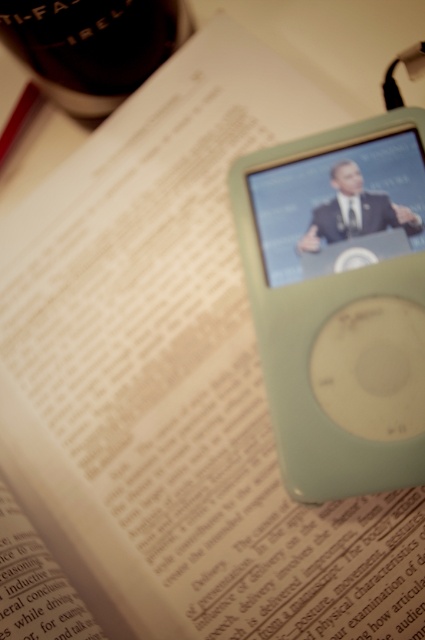
Can you confirm if light green plastic ipod at center is smaller than black glass bottle at top left?

No, light green plastic ipod at center is not smaller than black glass bottle at top left.

Is point (374, 141) positioned behind point (33, 67)?

No, it is not.

Is point (323, 394) closer to viewer compared to point (167, 36)?

Yes, it is.

Find the location of `light green plastic ipod at center`. light green plastic ipod at center is located at coordinates (340, 301).